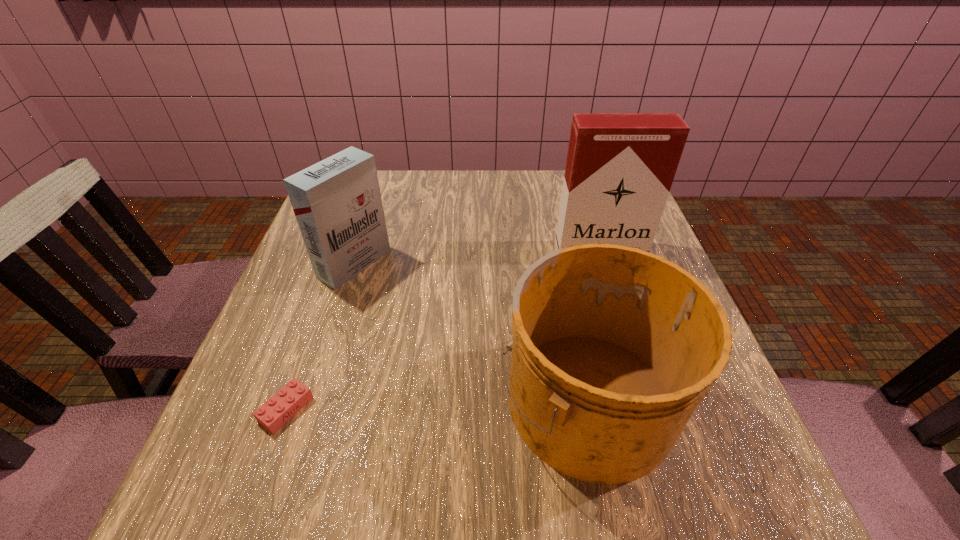
At what (x,y) coordinates should I click in order to perform the action: click on cigarette case that is at the left edge. Please return your answer as a coordinate pair (x, y). Image resolution: width=960 pixels, height=540 pixels. Looking at the image, I should click on (337, 203).

I want to click on Lego located at the left edge, so click(276, 411).

I want to click on cigarette_case located in the right edge section of the desktop, so click(x=620, y=167).

Where is `bucket that is positioned at the right edge`? This screenshot has height=540, width=960. bucket that is positioned at the right edge is located at coordinates (613, 348).

Where is `object present at the near right corner`? This screenshot has width=960, height=540. object present at the near right corner is located at coordinates (613, 348).

This screenshot has width=960, height=540. In the image, there is a desktop. In order to click on free space at the far edge in this screenshot , I will do tap(527, 172).

Where is `vacant space at the near edge of the desktop`? The height and width of the screenshot is (540, 960). vacant space at the near edge of the desktop is located at coordinates (428, 474).

In the image, there is a desktop. Identify the location of vacant space at the left edge. This screenshot has height=540, width=960. (268, 441).

This screenshot has width=960, height=540. In the image, there is a desktop. Find the location of `vacant area at the near right corner`. vacant area at the near right corner is located at coordinates (712, 505).

Image resolution: width=960 pixels, height=540 pixels. I want to click on empty space between the left cigarette case and the bucket, so click(471, 331).